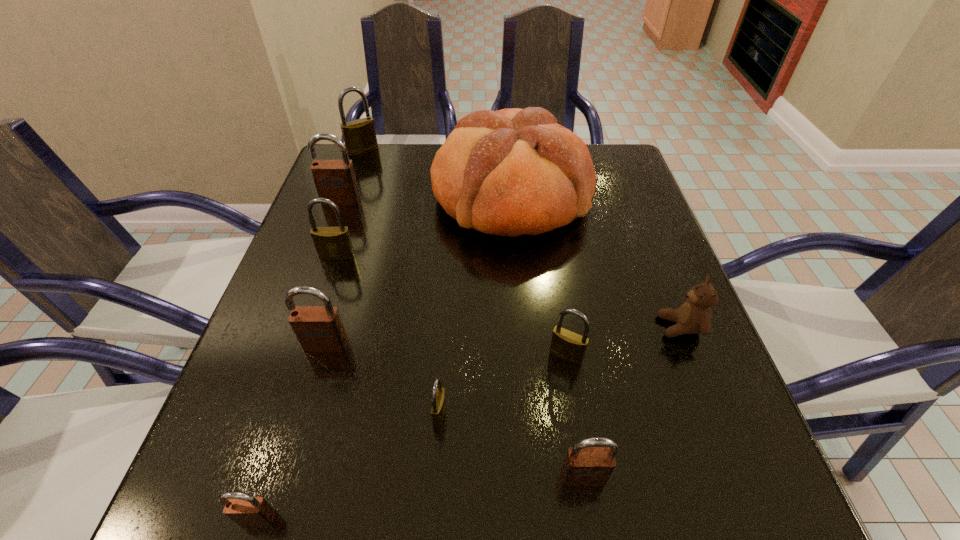
Identify the location of bread. (510, 172).

Identify the location of the farthest brass padlock. (359, 135).

I want to click on the farthest padlock, so click(x=359, y=135).

This screenshot has width=960, height=540. In order to click on the biggest brown padlock in this screenshot , I will do `click(335, 180)`.

Image resolution: width=960 pixels, height=540 pixels. Identify the location of the seventh nearest padlock. (335, 180).

At what (x,y) coordinates should I click in order to perform the action: click on the fourth farthest object. Please return your answer as a coordinate pair (x, y). Image resolution: width=960 pixels, height=540 pixels. Looking at the image, I should click on (332, 243).

I want to click on the second farthest brass padlock, so click(x=332, y=243).

The width and height of the screenshot is (960, 540). I want to click on the second farthest brown padlock, so click(x=317, y=328).

At what (x,y) coordinates should I click in order to perform the action: click on the rightmost brass padlock. Please return your answer as a coordinate pair (x, y). The image size is (960, 540). Looking at the image, I should click on (565, 344).

At what (x,y) coordinates should I click in order to perform the action: click on the third farthest brass padlock. Please return your answer as a coordinate pair (x, y). The width and height of the screenshot is (960, 540). Looking at the image, I should click on (565, 344).